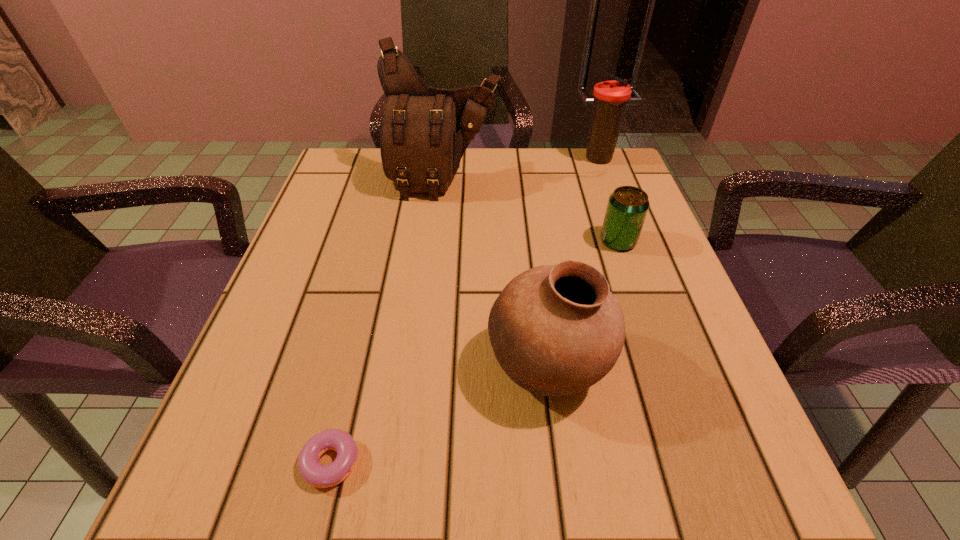
Where is `the tallest object`? the tallest object is located at coordinates (425, 131).

Where is `thermos bottle`? Image resolution: width=960 pixels, height=540 pixels. thermos bottle is located at coordinates (611, 97).

Locate an element on the screen. pottery is located at coordinates (556, 330).

Find the location of a particular element. This screenshot has width=960, height=540. the second shortest object is located at coordinates pyautogui.click(x=627, y=208).

At what (x,y) coordinates should I click in order to perform the action: click on the third farthest object. Please return your answer as a coordinate pair (x, y). Looking at the image, I should click on (627, 208).

Locate an element on the screen. This screenshot has height=540, width=960. the shortest object is located at coordinates (315, 474).

The width and height of the screenshot is (960, 540). What are the coordinates of `the nearest object` in the screenshot? It's located at (315, 474).

This screenshot has width=960, height=540. What are the coordinates of `blank space located 0.260m on the front-facing side of the shoulder bag` in the screenshot? It's located at (432, 286).

The image size is (960, 540). In order to click on free region located on the left of the thermos bottle in this screenshot , I will do coord(472,159).

Find the location of a particular element. This screenshot has width=960, height=540. free space located on the left of the pottery is located at coordinates (436, 367).